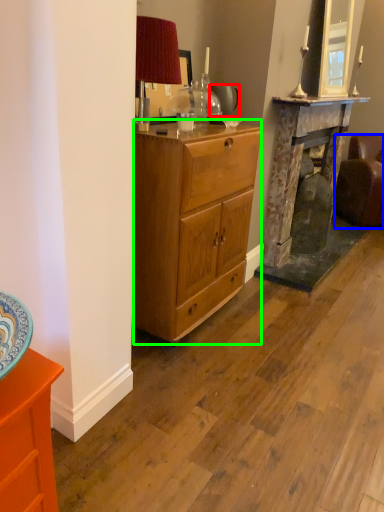
Question: Which is farther away from teapot (highlighted by a red box)? studio couch (highlighted by a blue box) or desk (highlighted by a green box)?

Choices:
 (A) studio couch
 (B) desk

Answer: (A)